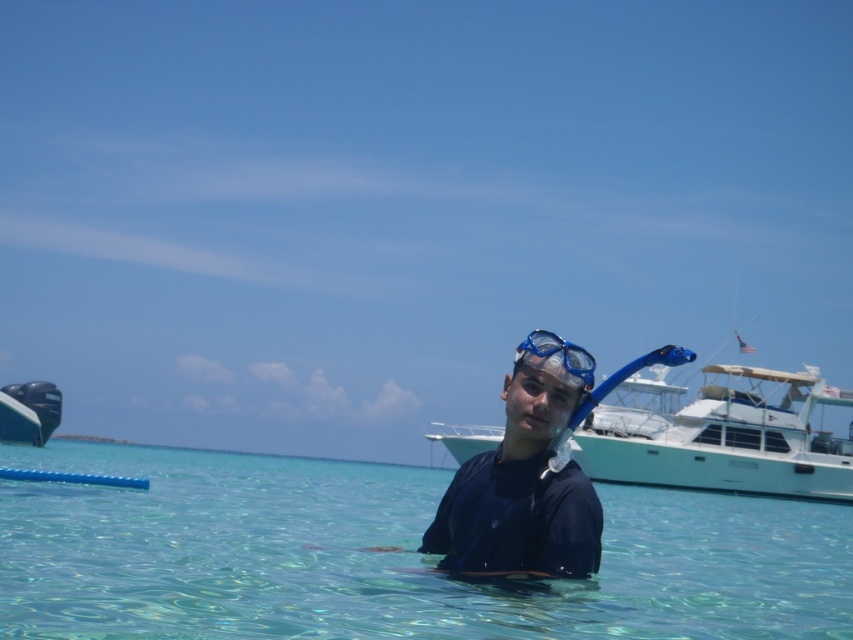
Question: Is white glossy boat at center smaller than blue matte snorkel mask at center?

Choices:
 (A) no
 (B) yes

Answer: (A)

Question: Which object is positioned closest to the blue matte snorkel mask at center?

Choices:
 (A) blue glossy boat at left
 (B) white glossy boat at center

Answer: (B)

Question: Can you confirm if clear water at center is positioned below blue glossy boat at left?

Choices:
 (A) yes
 (B) no

Answer: (A)

Question: Which of the following is the farthest from the observer?

Choices:
 (A) (579, 362)
 (B) (753, 584)

Answer: (B)

Question: Among these points, which one is farthest from the camera?

Choices:
 (A) (581, 452)
 (B) (47, 428)
 (C) (264, 544)
 (D) (581, 353)

Answer: (B)

Question: Does clear water at center appear on the left side of white glossy boat at center?

Choices:
 (A) no
 (B) yes

Answer: (B)